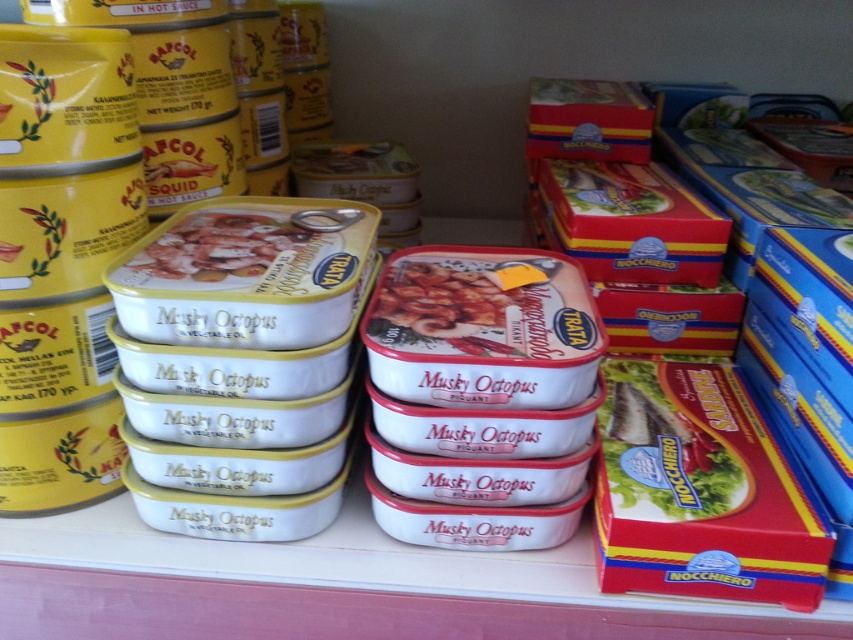
Question: Which of the following is the closest to the observer?

Choices:
 (A) white glossy musky octopus at center
 (B) white matte musky octopus at center
 (C) red cardboard box at right

Answer: (C)

Question: Does red cardboard box at right appear under white glossy musky octopus at center?

Choices:
 (A) yes
 (B) no

Answer: (A)

Question: Which of these objects is positioned farthest from the red cardboard box at right?

Choices:
 (A) white glossy musky octopus at center
 (B) matte cardboard fish at center right

Answer: (A)

Question: Which object is closer to the camera taking this photo?

Choices:
 (A) matte cardboard fish at center right
 (B) red cardboard box at right
 (C) white matte musky octopus at center

Answer: (B)

Question: Can you confirm if red cardboard box at right is thinner than matte cardboard fish at center right?

Choices:
 (A) no
 (B) yes

Answer: (A)

Question: Does red cardboard box at right have a greater width compared to white matte musky octopus at center?

Choices:
 (A) no
 (B) yes

Answer: (A)